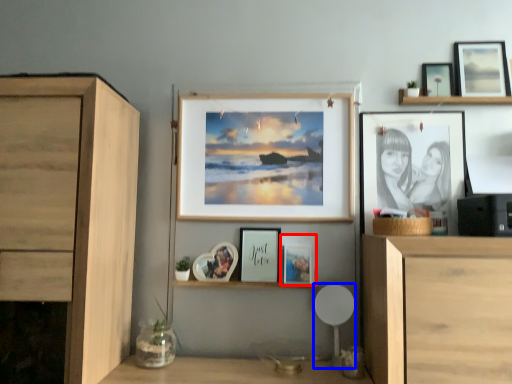
Question: Among these objects, which one is nearest to the camera, picture frame (highlighted by a red box) or chair (highlighted by a blue box)?

Choices:
 (A) picture frame
 (B) chair

Answer: (B)